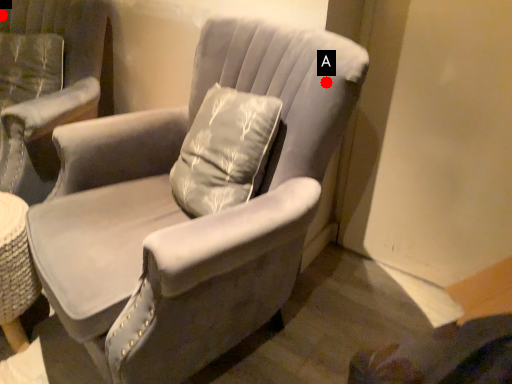
Question: Two points are circled on the image, labeled by A and B beside each circle. Which point appears farthest from the camera in this image?

Choices:
 (A) A is further
 (B) B is further

Answer: (B)